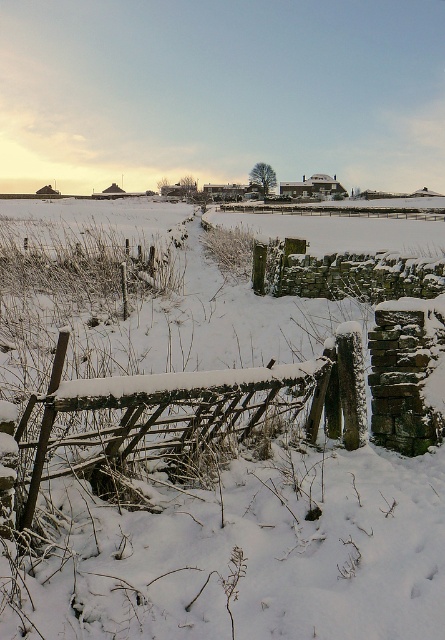
At what (x,y) coordinates should I click in order to perform the action: click on white frosty fence at center. Please return your answer as a coordinate pair (x, y). The image size is (445, 640). Looking at the image, I should click on (202, 460).

Is white frosty fence at center closer to camera compared to wooden wicker fence at center?

Yes.

Is point (158, 513) in front of point (348, 417)?

Yes, point (158, 513) is closer to viewer.

At what (x,y) coordinates should I click in order to perform the action: click on white frosty fence at center. Please return your answer as a coordinate pair (x, y). The height and width of the screenshot is (640, 445). Looking at the image, I should click on (202, 460).

Between wooden wicker fence at center and woven wood fence at center, which one is positioned lower?

wooden wicker fence at center is lower down.

Is wooden wicker fence at center above woven wood fence at center?

No.

I want to click on wooden wicker fence at center, so click(169, 420).

You are a GUI agent. You are given a task and a screenshot of the screen. Output one action in this format:
    pyautogui.click(x=<x>, y=<y>)
    Task: Click on the wooden wicker fence at center
    
    Given the screenshot: What is the action you would take?
    pyautogui.click(x=169, y=420)

Between white frosty fence at center and woven wood fence at center, which one has less height?

With less height is woven wood fence at center.

From the picture: Can you confirm if white frosty fence at center is positioned above woven wood fence at center?

No, white frosty fence at center is not above woven wood fence at center.

Where is `white frosty fence at center`? Image resolution: width=445 pixels, height=640 pixels. white frosty fence at center is located at coordinates (202, 460).